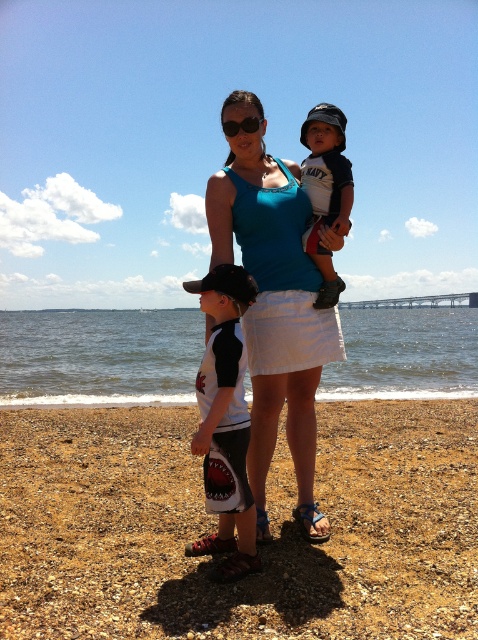
Question: Observing the image, what is the correct spatial positioning of brown gravel at lower center in reference to white matte shirt at center?

Choices:
 (A) above
 (B) below

Answer: (B)

Question: Is brown gravel at lower center smaller than white matte shirt at center?

Choices:
 (A) no
 (B) yes

Answer: (B)

Question: Which point is closer to the camera taking this photo?

Choices:
 (A) (459, 522)
 (B) (249, 115)
 (C) (306, 237)
 (D) (82, 324)

Answer: (B)

Question: Is brown gravel at lower center in front of white matte shirt at center?

Choices:
 (A) yes
 (B) no

Answer: (B)

Question: Which object is the farthest from the clear blue water at center?

Choices:
 (A) blue fabric tank top at center
 (B) matte navy blue shirt at upper center
 (C) brown gravel at lower center

Answer: (C)

Question: Estimate the real-world distances between objects in this image. Which object is farther from the matte navy blue shirt at upper center?

Choices:
 (A) brown gravel at lower center
 (B) white matte shirt at center
 (C) blue fabric tank top at center

Answer: (A)